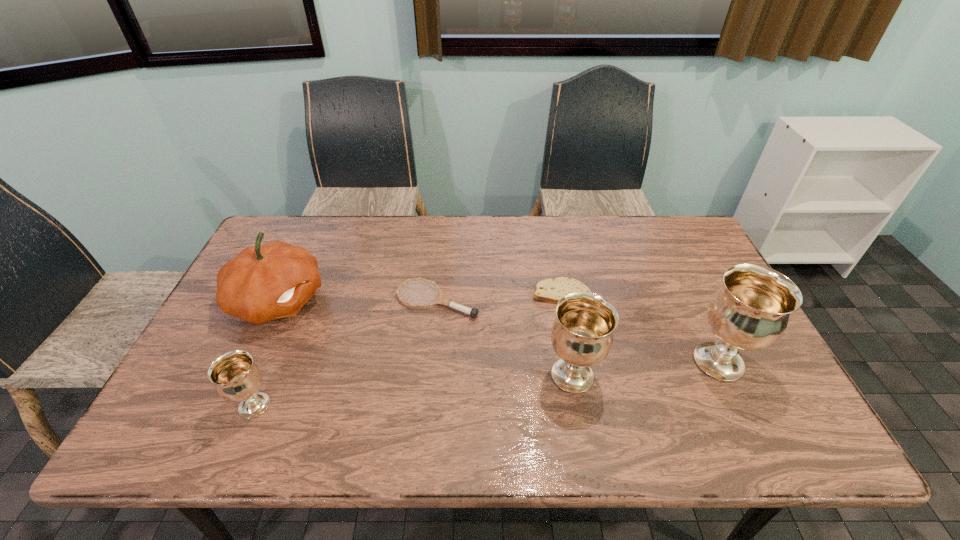
Select which object is the closest to the third object from left to right. Please provide its 2D coordinates. Your answer should be formatted as a tuple, i.e. [(x, y)], where the tuple contains the x and y coordinates of a point satisfying the conditions above.

[(549, 290)]

Where is `object that is the third closest to the shortest chalice`? object that is the third closest to the shortest chalice is located at coordinates (582, 334).

Locate which chalice is the closest to the shortest chalice. Please provide its 2D coordinates. Your answer should be formatted as a tuple, i.e. [(x, y)], where the tuple contains the x and y coordinates of a point satisfying the conditions above.

[(582, 334)]

Identify which chalice is located as the second nearest to the second tallest chalice. Please provide its 2D coordinates. Your answer should be formatted as a tuple, i.e. [(x, y)], where the tuple contains the x and y coordinates of a point satisfying the conditions above.

[(236, 377)]

The width and height of the screenshot is (960, 540). Find the location of `free location that satisfies the following two spatial constraints: 1. on the front face of the rightmost chalice; 2. on the right side of the pumpkin`. free location that satisfies the following two spatial constraints: 1. on the front face of the rightmost chalice; 2. on the right side of the pumpkin is located at coordinates (251, 362).

The height and width of the screenshot is (540, 960). I want to click on free space that satisfies the following two spatial constraints: 1. on the front side of the shortest object; 2. on the front face of the pumpkin, so click(x=563, y=301).

At what (x,y) coordinates should I click in order to perform the action: click on free space that satisfies the following two spatial constraints: 1. on the front face of the pumpkin; 2. on the left side of the second tallest chalice. Please return your answer as a coordinate pair (x, y). Looking at the image, I should click on (244, 375).

The image size is (960, 540). Identify the location of blank area in the image that satisfies the following two spatial constraints: 1. on the front face of the pumpkin; 2. on the left side of the rightmost object. (251, 362).

The width and height of the screenshot is (960, 540). Find the location of `free region that satisfies the following two spatial constraints: 1. on the front face of the second chalice from right to left; 2. on the left side of the pumpkin`. free region that satisfies the following two spatial constraints: 1. on the front face of the second chalice from right to left; 2. on the left side of the pumpkin is located at coordinates (244, 375).

Where is `vacant region that satisfies the following two spatial constraints: 1. on the front side of the pita bread; 2. on the right side of the rightmost chalice`? This screenshot has width=960, height=540. vacant region that satisfies the following two spatial constraints: 1. on the front side of the pita bread; 2. on the right side of the rightmost chalice is located at coordinates (574, 362).